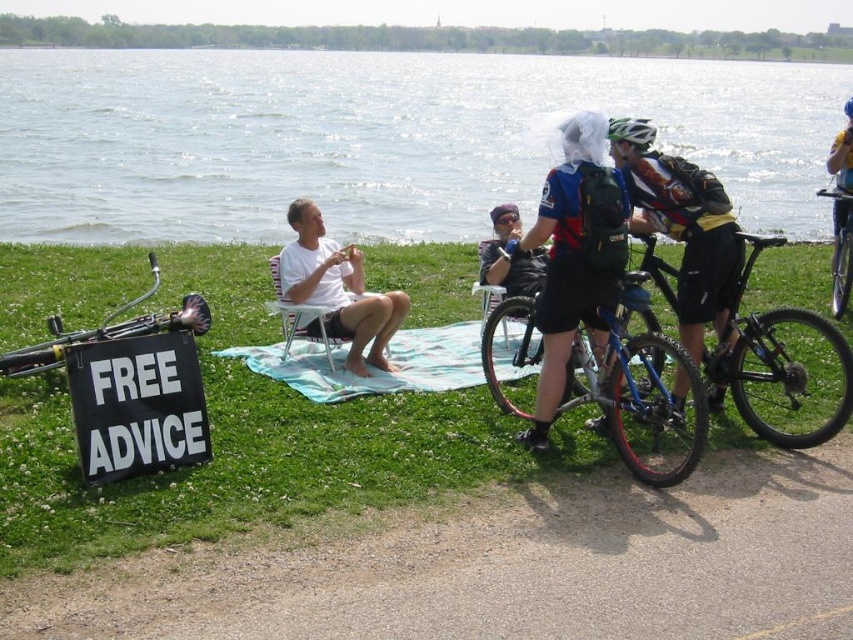
Question: Can you confirm if green grass at lower left is positioned below blue matte bicycle at center?

Choices:
 (A) yes
 (B) no

Answer: (B)

Question: Which object is closer to the camera taking this photo?

Choices:
 (A) blue matte bicycle at center
 (B) white matte shirt at center
 (C) green matte bicycle helmet at upper center
 (D) green grass at lower left

Answer: (D)

Question: Does shiny blue helmet at center come in front of green matte bicycle helmet at upper center?

Choices:
 (A) yes
 (B) no

Answer: (A)

Question: Is light blue fabric blanket at center above white matte shirt at center?

Choices:
 (A) yes
 (B) no

Answer: (B)

Question: Which object is closer to the camera taking this photo?

Choices:
 (A) light blue fabric blanket at center
 (B) clear water at upper center

Answer: (B)

Question: Estimate the real-world distances between objects in this image. Which object is farther from the green matte bicycle helmet at upper center?

Choices:
 (A) light blue fabric blanket at center
 (B) clear water at upper center
 (C) shiny silver bicycle at right
 (D) blue matte bicycle at center

Answer: (B)